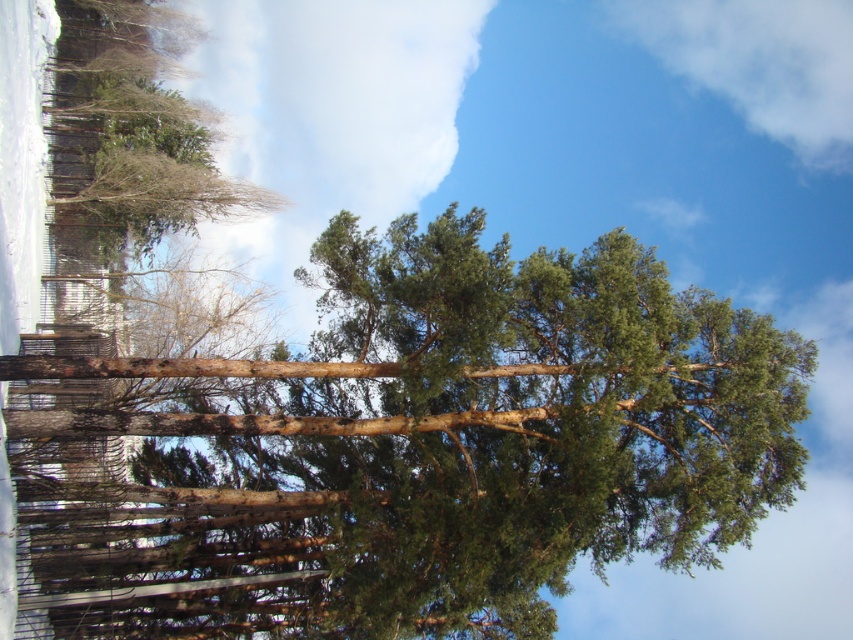
Question: Can you confirm if green needle-like at center is bigger than white fluffy cloud at upper center?

Choices:
 (A) yes
 (B) no

Answer: (B)

Question: Which of these objects is positioned farthest from the white fluffy cloud at upper center?

Choices:
 (A) white fluffy cloud at upper right
 (B) green needle-like at center

Answer: (A)

Question: Does green needle-like at center appear on the left side of white fluffy cloud at upper center?

Choices:
 (A) no
 (B) yes

Answer: (A)

Question: Can you confirm if green needle-like at center is positioned to the right of white fluffy cloud at upper right?

Choices:
 (A) no
 (B) yes

Answer: (A)

Question: Which object appears closest to the camera in this image?

Choices:
 (A) white fluffy cloud at upper center
 (B) green needle-like at center

Answer: (B)

Question: Which point appears closest to the camera in this image?

Choices:
 (A) (825, 52)
 (B) (345, 616)
 (C) (434, 72)

Answer: (B)